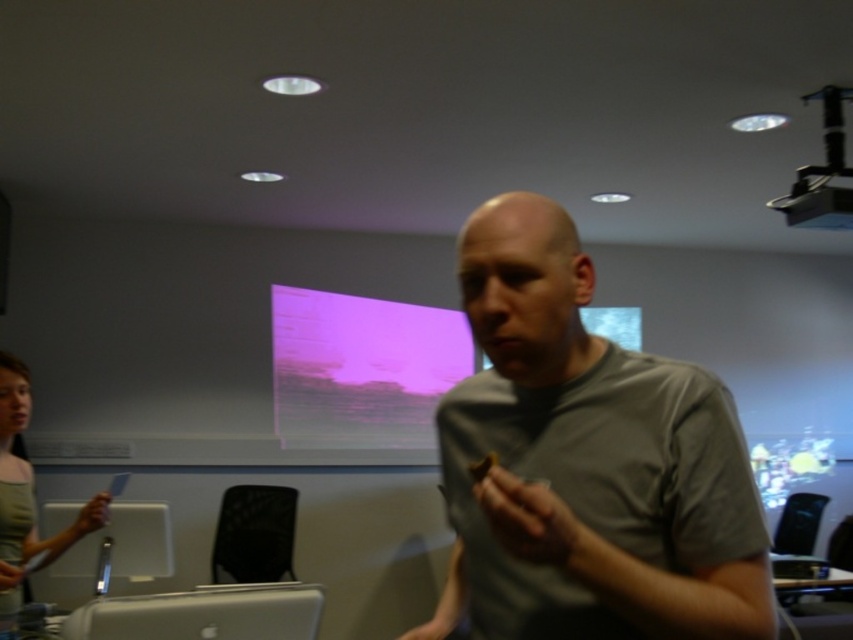
In the scene shown: You are a photographer setting up for a presentation. You need to position a camera to capture both the purple matte projection screen at upper center and the green fabric shirt at left clearly. Considering their sizes, which object should you focus on first to ensure both are in frame?

The purple matte projection screen at upper center is larger in size than the green fabric shirt at left, so you should focus on the purple matte projection screen at upper center first to ensure both are in frame.